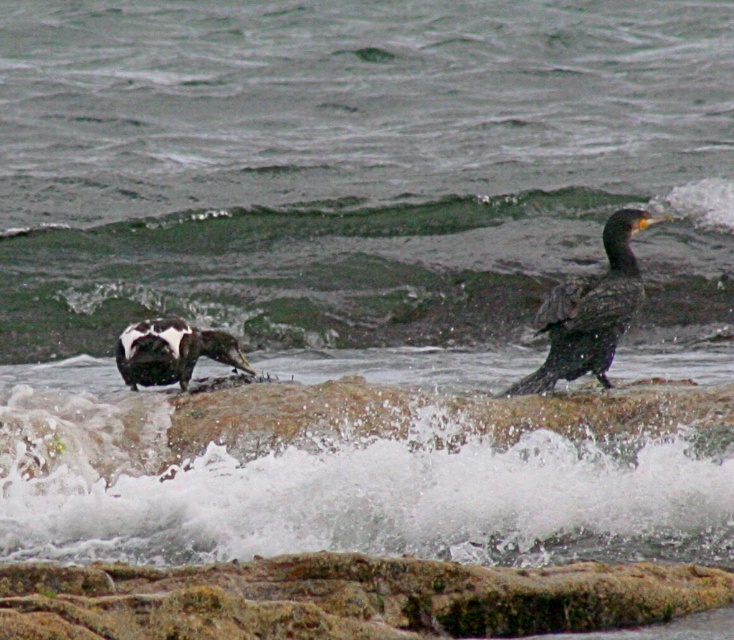
Question: Where is white frothy water at center located in relation to dark feathers bird at right in the image?

Choices:
 (A) below
 (B) above

Answer: (A)

Question: Is white frothy water at center bigger than black-and-white feathers at left?

Choices:
 (A) yes
 (B) no

Answer: (A)

Question: Which object is farther from the camera taking this photo?

Choices:
 (A) green mossy rock at center
 (B) rusty rock at center
 (C) white frothy water at center

Answer: (A)

Question: Observing the image, what is the correct spatial positioning of white frothy water at center in reference to green mossy rock at center?

Choices:
 (A) above
 (B) below

Answer: (B)

Question: Estimate the real-world distances between objects in this image. Which object is farther from the dark feathers bird at right?

Choices:
 (A) rusty rock at center
 (B) white frothy water at center
 (C) black-and-white feathers at left
 (D) green mossy rock at center

Answer: (D)

Question: Which object appears closest to the camera in this image?

Choices:
 (A) black-and-white feathers at left
 (B) rusty rock at center
 (C) green mossy rock at center
 (D) white frothy water at center

Answer: (B)